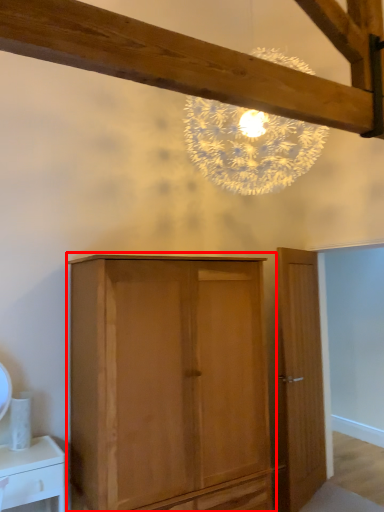
Question: In this image, where is cupboard (annotated by the red box) located relative to door?

Choices:
 (A) right
 (B) left

Answer: (B)